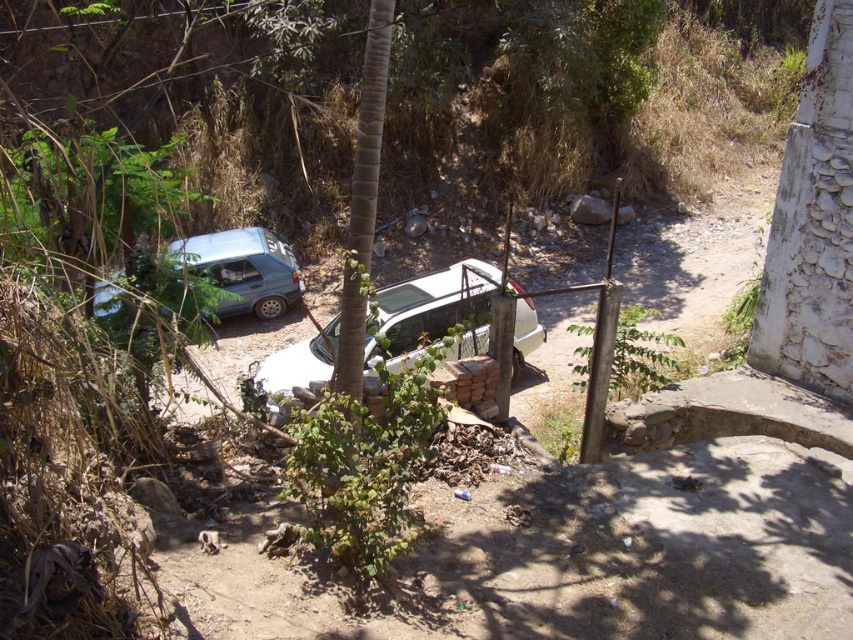
You are a drone operator trying to capture aerial footage of the two points in the scene. Which point, point (x=408, y=307) or point (x=363, y=76), would require the drone to fly closer to the ground to film?

Point (x=408, y=307) is closer to the camera than point (x=363, y=76), so the drone would need to fly closer to the ground to film point (x=408, y=307).

You are a delivery driver who needs to back out of the white matte car at center. There is a green textured tree at center behind it. Considering the space available, can you safely back up without hitting the tree?

The green textured tree at center is behind the white matte car at center, so you cannot safely back up without the risk of hitting the tree since the tree is directly in the path behind the car.